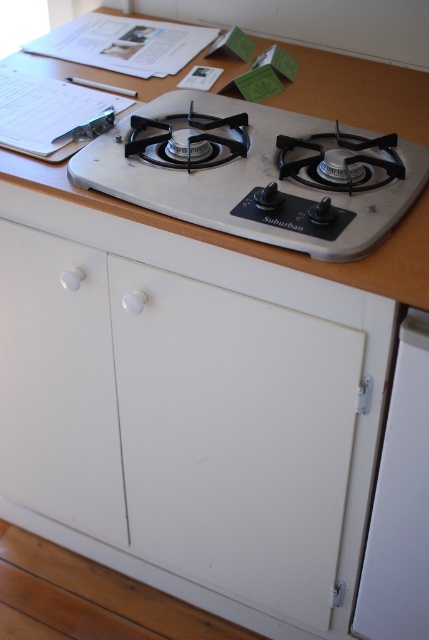
Question: Can you confirm if white plastic gas stove at center is positioned to the right of white plastic knob at center?

Choices:
 (A) yes
 (B) no

Answer: (A)

Question: Does wooden table at upper center appear on the right side of white plastic knob at center?

Choices:
 (A) no
 (B) yes

Answer: (B)

Question: Which point appears farthest from the camera in this image?

Choices:
 (A) (278, 129)
 (B) (60, 284)
 (C) (416, 220)

Answer: (A)

Question: Is wooden table at upper center below white plastic knob at lower left?

Choices:
 (A) no
 (B) yes

Answer: (A)

Question: Which object appears closest to the camera in this image?

Choices:
 (A) wooden table at upper center
 (B) white plastic gas stove at center
 (C) white plastic knob at lower left

Answer: (A)

Question: Based on their relative distances, which object is farther from the wooden table at upper center?

Choices:
 (A) white plastic knob at lower left
 (B) white plastic gas stove at center

Answer: (A)